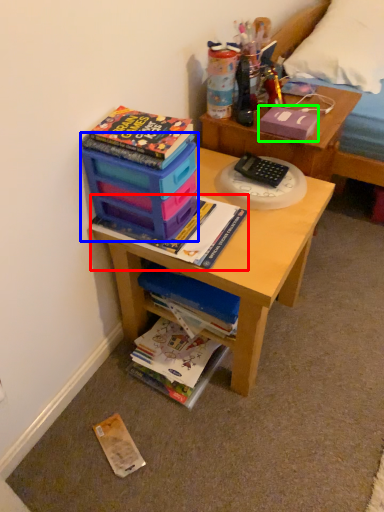
Question: Estimate the real-world distances between objects in this image. Which object is farther from book (highlighted by a red box), storage box (highlighted by a blue box) or paperback book (highlighted by a green box)?

Choices:
 (A) storage box
 (B) paperback book

Answer: (B)